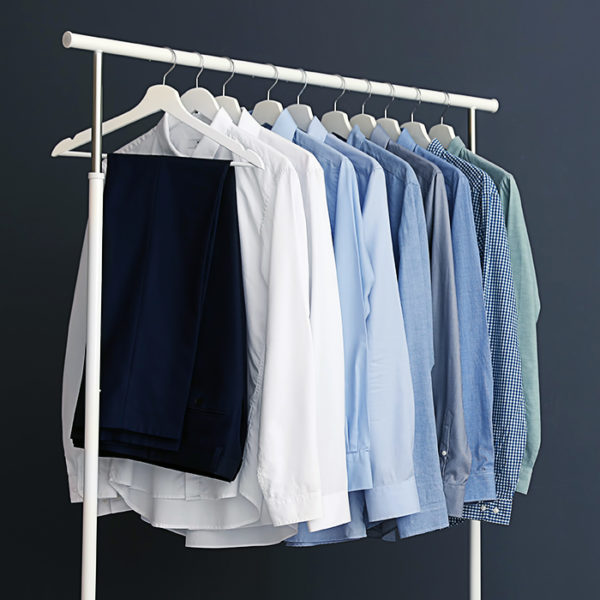
Where is `hangers`? The width and height of the screenshot is (600, 600). hangers is located at coordinates (160, 94), (205, 94), (225, 96), (271, 102), (301, 110), (336, 111), (364, 113), (391, 118), (409, 118), (447, 125).